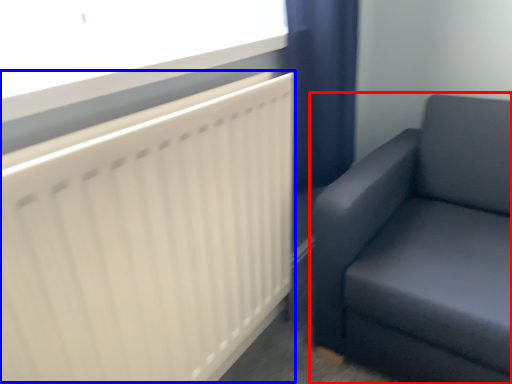
Question: Which object appears farthest to the camera in this image, studio couch (highlighted by a red box) or radiator (highlighted by a blue box)?

Choices:
 (A) studio couch
 (B) radiator

Answer: (A)